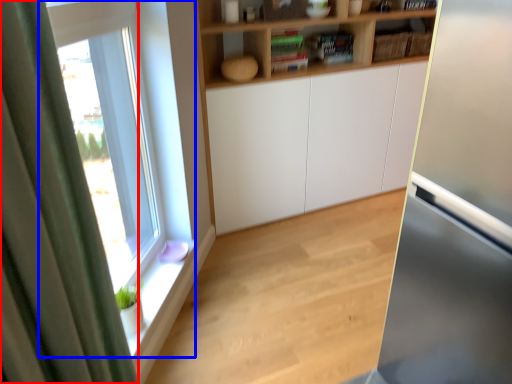
Question: Which point is further to the camera, curtain (highlighted by a red box) or window (highlighted by a blue box)?

Choices:
 (A) curtain
 (B) window

Answer: (B)